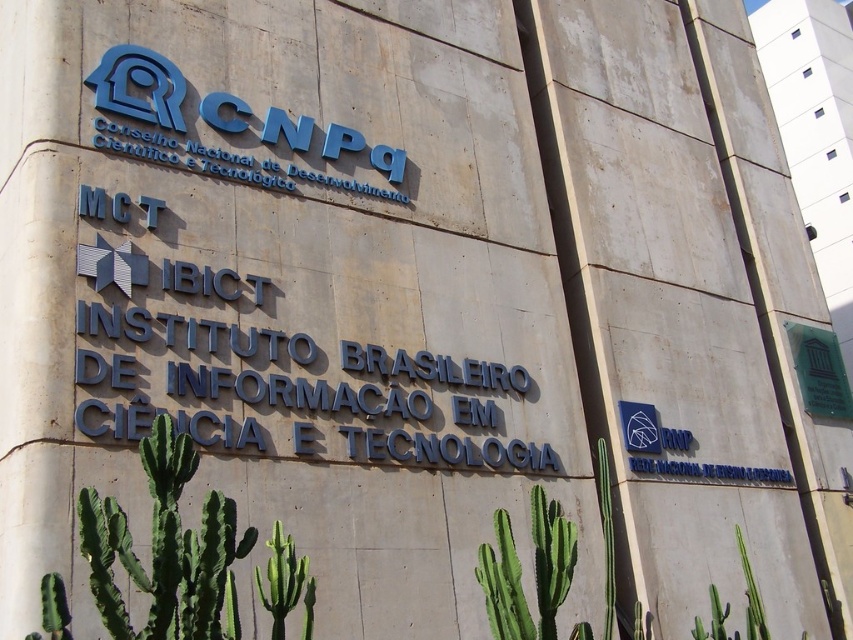
Question: Considering the relative positions of blue metallic sign at upper center and green spiny cactus at lower left in the image provided, where is blue metallic sign at upper center located with respect to green spiny cactus at lower left?

Choices:
 (A) below
 (B) above

Answer: (B)

Question: Which object is closer to the camera taking this photo?

Choices:
 (A) blue plastic sign at upper center
 (B) green spiky cactus at lower center
 (C) green spiny cactus at lower left

Answer: (C)

Question: Which point is farther from the camera taking this photo?

Choices:
 (A) click(x=268, y=595)
 (B) click(x=355, y=284)
 (C) click(x=167, y=492)
 (D) click(x=161, y=128)

Answer: (B)

Question: Which of the following is the farthest from the observer?

Choices:
 (A) (308, 634)
 (B) (115, 84)

Answer: (B)

Question: Where is blue metallic sign at upper center located in relation to blue plastic sign at upper center in the image?

Choices:
 (A) right
 (B) left

Answer: (A)

Question: Can you confirm if green glass plaque at upper right is positioned to the left of green spiky cactus at lower center?

Choices:
 (A) no
 (B) yes

Answer: (A)